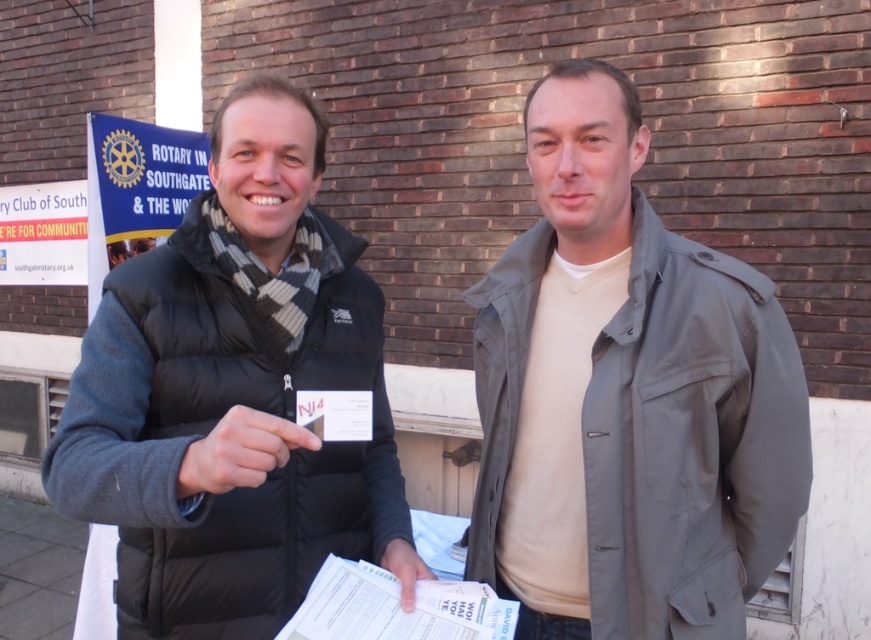
Who is higher up, black puffer vest at left or white paper at center?

black puffer vest at left is above.

Looking at this image, between black puffer vest at left and white paper at center, which one has less height?

With less height is white paper at center.

Which is behind, point (240, 353) or point (402, 602)?

The point (240, 353) is behind.

Locate an element on the screen. The image size is (871, 640). black puffer vest at left is located at coordinates (233, 392).

Is point (625, 604) farther from viewer compared to point (133, 438)?

That is True.

Does light gray fabric jacket at center appear under black puffer vest at left?

Incorrect, light gray fabric jacket at center is not positioned below black puffer vest at left.

What do you see at coordinates (626, 397) in the screenshot?
I see `light gray fabric jacket at center` at bounding box center [626, 397].

Where is `light gray fabric jacket at center`? light gray fabric jacket at center is located at coordinates (626, 397).

Who is more distant from viewer, (260, 428) or (403, 596)?

The point (403, 596) is behind.

Between black matte card at center and white paper at center, which one appears on the left side from the viewer's perspective?

black matte card at center

Between point (237, 458) and point (415, 560), which one is positioned in front?

Point (237, 458) is in front.

This screenshot has height=640, width=871. Identify the location of black matte card at center. (240, 451).